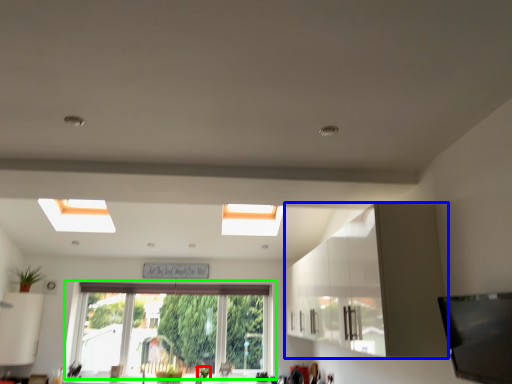
Question: Estimate the real-world distances between objects in this image. Which object is closer to plant (highlighted by a red box), cabinetry (highlighted by a blue box) or window (highlighted by a green box)?

Choices:
 (A) cabinetry
 (B) window

Answer: (B)